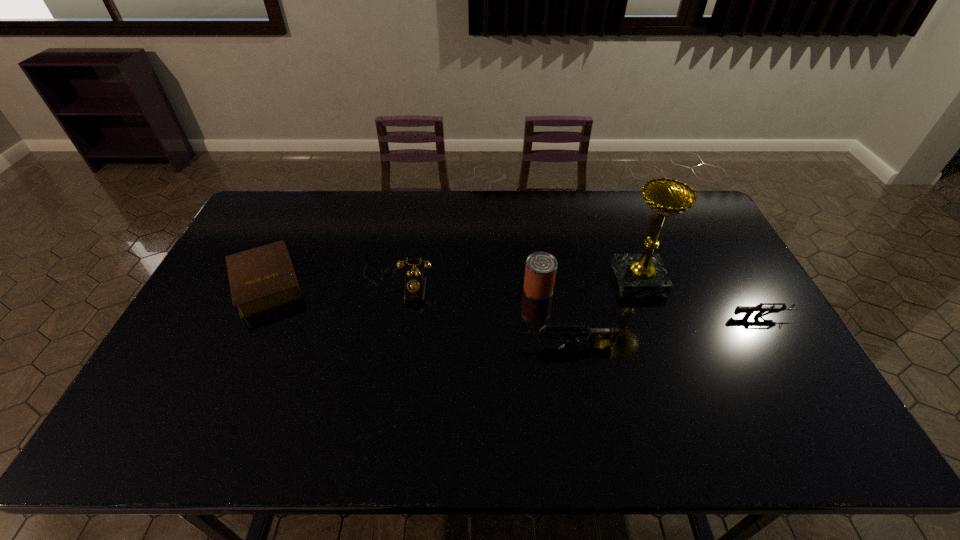
Where is `the nearer gun`? The height and width of the screenshot is (540, 960). the nearer gun is located at coordinates (591, 334).

Image resolution: width=960 pixels, height=540 pixels. Find the location of `the taller gun`. the taller gun is located at coordinates (591, 334).

Image resolution: width=960 pixels, height=540 pixels. Identify the location of the shorter gun. (749, 310).

You are a GUI agent. You are given a task and a screenshot of the screen. Output one action in this format:
    pyautogui.click(x=<x>, y=<y>)
    Task: Click on the rightmost object
    
    Given the screenshot: What is the action you would take?
    pyautogui.click(x=749, y=310)

Where is `telephone`? The image size is (960, 540). telephone is located at coordinates (415, 283).

Find the location of `can`. can is located at coordinates (540, 271).

Where is `the leftmost object`? The width and height of the screenshot is (960, 540). the leftmost object is located at coordinates (263, 278).

At what (x,y) coordinates should I click in order to perform the action: click on the fifth object from left to right. Please return your answer as a coordinate pair (x, y). Looking at the image, I should click on (638, 275).

Identify the location of award. Image resolution: width=960 pixels, height=540 pixels. (638, 275).

Find the location of a particular element. This screenshot has height=540, width=960. vacant region located 0.210m aimed along the barrel of the fourth tallest object is located at coordinates (437, 344).